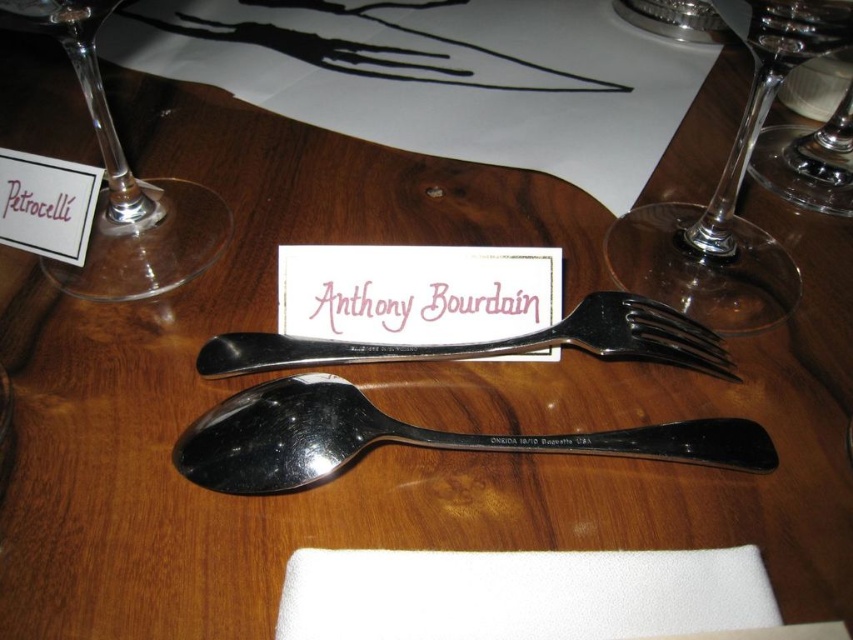
Question: Based on their relative distances, which object is farther from the pink paper name card at center?

Choices:
 (A) clear glass wine glass at left
 (B) polished silver fork at center

Answer: (A)

Question: Can you confirm if transparent glass wine glass at upper right is positioned to the right of polished silver fork at center?

Choices:
 (A) yes
 (B) no

Answer: (A)

Question: Which of the following is the farthest from the observer?

Choices:
 (A) white fabric napkin at center
 (B) transparent glass wine glass at upper right
 (C) polished silver fork at center

Answer: (C)

Question: Does polished silver spoon at center lie behind clear glass wine glass at upper right?

Choices:
 (A) yes
 (B) no

Answer: (A)

Question: Can you confirm if clear glass wine glass at left is smaller than black paper at upper left?

Choices:
 (A) yes
 (B) no

Answer: (B)

Question: Among these points, which one is nearest to the camera?

Choices:
 (A) (236, 346)
 (B) (16, 198)
 (C) (88, 99)

Answer: (A)